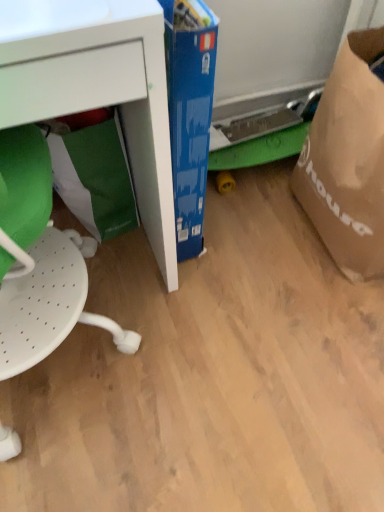
The width and height of the screenshot is (384, 512). I want to click on vacant area in front of blue cardboard box at center, so click(173, 286).